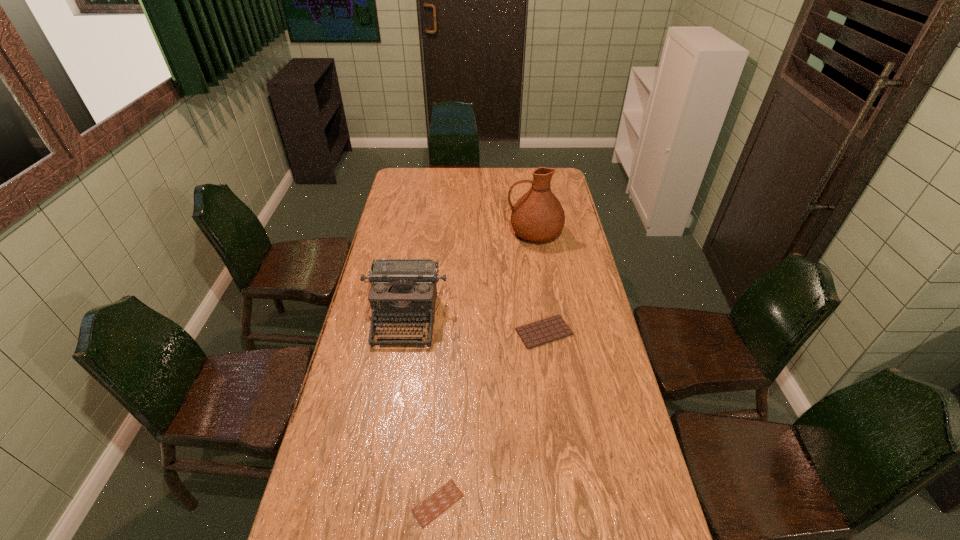
Where is `empty space that is in between the nearer chocolate bar and the farthest object`? empty space that is in between the nearer chocolate bar and the farthest object is located at coordinates (486, 368).

The height and width of the screenshot is (540, 960). I want to click on vacant space that is in between the shorter chocolate bar and the tallest object, so click(486, 368).

Where is `vacant area that lies between the pitcher and the nearest object`? vacant area that lies between the pitcher and the nearest object is located at coordinates (486, 368).

Locate an element on the screen. This screenshot has height=540, width=960. free spot between the farther chocolate bar and the third shortest object is located at coordinates (475, 325).

Find the location of a particular element. Image resolution: width=960 pixels, height=540 pixels. free point between the third shortest object and the shortest object is located at coordinates (421, 410).

Where is `vacant space in between the tallest object and the taller chocolate bar`? The height and width of the screenshot is (540, 960). vacant space in between the tallest object and the taller chocolate bar is located at coordinates pyautogui.click(x=540, y=282).

The height and width of the screenshot is (540, 960). Identify the location of vacant area that lies between the shorter chocolate bar and the right chocolate bar. (491, 417).

Image resolution: width=960 pixels, height=540 pixels. What are the coordinates of `free space that is in between the pitcher and the right chocolate bar` in the screenshot? It's located at (540, 282).

Identify the location of unoccupied area between the second tallest object and the farther chocolate bar. Image resolution: width=960 pixels, height=540 pixels. (475, 325).

The height and width of the screenshot is (540, 960). Identify the location of object that can be found as the third closest to the nearest object. (537, 216).